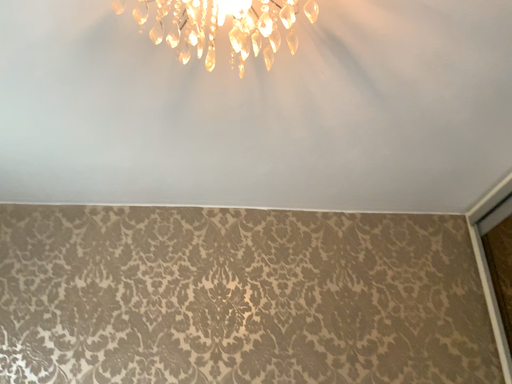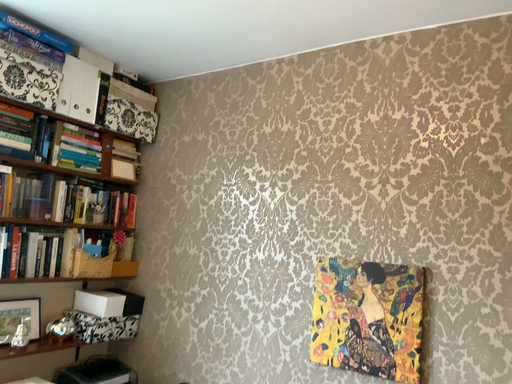
Question: How did the camera likely rotate when shooting the video?

Choices:
 (A) rotated right
 (B) rotated left

Answer: (B)